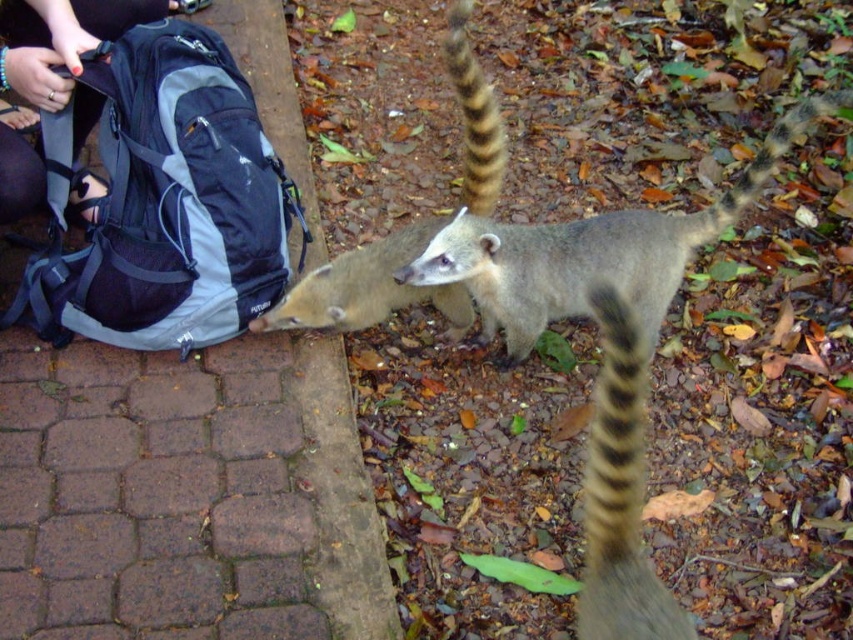
You are a wildlife photographer trying to capture a photo of the fuzzy gray lemur at center and the brown fuzzy tail at upper right. Which object should you focus on first if you want to include both in your frame without moving the camera?

The fuzzy gray lemur at center should be focused on first because it is wider than the brown fuzzy tail at upper right, so capturing its width ensures the tail will also fit in the frame.